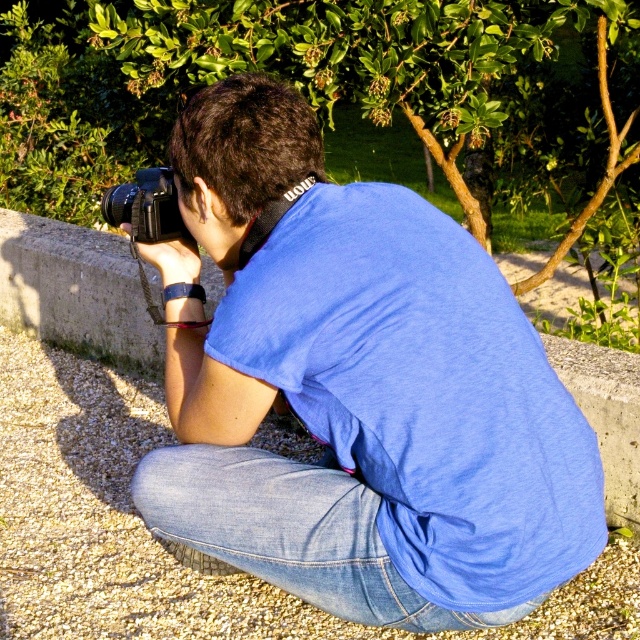
Which is below, gray gravel at lower left or denim at lower center?

denim at lower center is below.

Which is behind, point (1, 628) or point (186, 499)?

The point (1, 628) is more distant.

The width and height of the screenshot is (640, 640). I want to click on gray gravel at lower left, so click(106, 516).

Is point (220, 502) behind point (116, 216)?

No, it is in front of (116, 216).

Does denim at lower center have a greater height compared to black plastic camera at center?

Correct, denim at lower center is much taller as black plastic camera at center.

Is point (308, 492) behind point (124, 212)?

No, it is not.

Where is `denim at lower center`? This screenshot has width=640, height=640. denim at lower center is located at coordinates (291, 532).

Who is positioned more to the right, blue cotton shirt at center or gray gravel at lower left?

blue cotton shirt at center is more to the right.

Can you confirm if blue cotton shirt at center is taller than gray gravel at lower left?

Yes, blue cotton shirt at center is taller than gray gravel at lower left.

Does point (266, 564) come farther from viewer compared to point (147, 554)?

That is False.

Where is `blue cotton shirt at center`? blue cotton shirt at center is located at coordinates (362, 392).